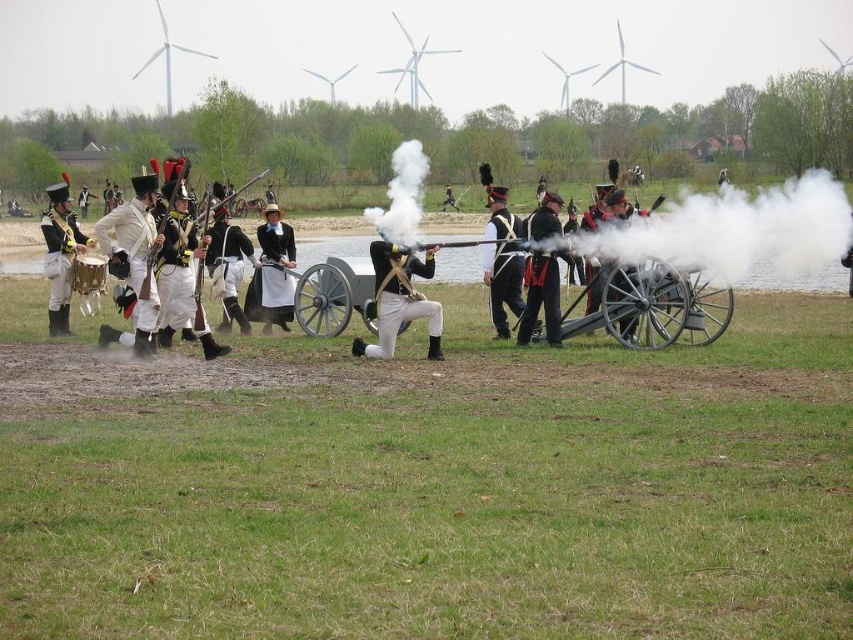
Question: In this image, where is matte black uniform at left located relative to shiny black uniform at center?

Choices:
 (A) right
 (B) left

Answer: (B)

Question: Which of the following is the farthest from the observer?

Choices:
 (A) white cotton uniform at left
 (B) matte black uniform at left
 (C) matte black uniform at center

Answer: (B)

Question: Does matte black uniform at center have a greater width compared to white cotton uniform at center?

Choices:
 (A) no
 (B) yes

Answer: (B)

Question: Does matte black uniform at center appear over matte black dress at center?

Choices:
 (A) no
 (B) yes

Answer: (A)

Question: Estimate the real-world distances between objects in this image. Which object is farther from the white cotton uniform at left?

Choices:
 (A) matte black dress at center
 (B) matte black uniform at left
 (C) white cotton uniform at center

Answer: (A)

Question: Which object is positioned farthest from the white cotton uniform at left?

Choices:
 (A) matte black uniform at center
 (B) matte black uniform at left

Answer: (A)